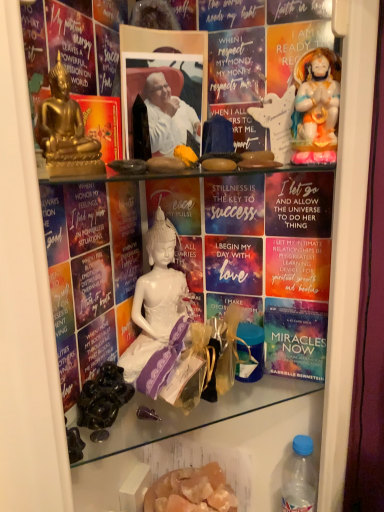
Identify the location of white porcelain statue at upper right. The height and width of the screenshot is (512, 384). (277, 122).

This screenshot has height=512, width=384. I want to click on gold polished buddha statue at upper left, which is the second person from back to front, so click(63, 122).

The width and height of the screenshot is (384, 512). Describe the element at coordinates (63, 122) in the screenshot. I see `gold polished buddha statue at upper left, which is the second person from back to front` at that location.

Image resolution: width=384 pixels, height=512 pixels. Describe the element at coordinates (316, 99) in the screenshot. I see `white glossy statue at upper right, which ranks as the first person in right-to-left order` at that location.

This screenshot has height=512, width=384. Identify the location of translucent orange crystals at lower center, which ranks as the first food in bottom-to-top order. (191, 490).

The height and width of the screenshot is (512, 384). What are the coordinates of `blue plastic bottle at lower right` in the screenshot? It's located at (300, 478).

From the picture: Measure the distance between point (314,479) and camera.

Point (314,479) and camera are 28.62 inches apart.

This screenshot has width=384, height=512. I want to click on white porcelain statue at upper right, so click(277, 122).

Which is correct: black glossy grapes at lower left, marked as the first food in a left-to-right arrangement, is inside gold polished buddha statue at upper left, which is the second person from back to front, or outside of it?

black glossy grapes at lower left, marked as the first food in a left-to-right arrangement, lies outside gold polished buddha statue at upper left, which is the second person from back to front.

Is black glossy grapes at lower left, the 1th food positioned from the top, to the left of gold polished buddha statue at upper left, the 1th person in the left-to-right sequence, from the viewer's perspective?

No, black glossy grapes at lower left, the 1th food positioned from the top, is not to the left of gold polished buddha statue at upper left, the 1th person in the left-to-right sequence.

Is black glossy grapes at lower left, the 1th food from the front, positioned before gold polished buddha statue at upper left, which is the first person from front to back?

That is False.

From a real-world perspective, who is located higher, black glossy grapes at lower left, acting as the second food starting from the right, or gold polished buddha statue at upper left, the 1th person in the left-to-right sequence?

From a 3D spatial view, gold polished buddha statue at upper left, the 1th person in the left-to-right sequence, is above.

Considering the relative positions of gold polished buddha statue at upper left, the 1th person in the left-to-right sequence, and translucent orange crystals at lower center, marked as the second food in a front-to-back arrangement, in the image provided, is gold polished buddha statue at upper left, the 1th person in the left-to-right sequence, to the right of translucent orange crystals at lower center, marked as the second food in a front-to-back arrangement, from the viewer's perspective?

No.

How many degrees apart are the facing directions of gold polished buddha statue at upper left, the 1th person in the left-to-right sequence, and translucent orange crystals at lower center, marked as the second food in a front-to-back arrangement?

The angle between the facing direction of gold polished buddha statue at upper left, the 1th person in the left-to-right sequence, and the facing direction of translucent orange crystals at lower center, marked as the second food in a front-to-back arrangement, is 19.7 degrees.

Do you think gold polished buddha statue at upper left, which is the first person from front to back, is within translucent orange crystals at lower center, which ranks as the first food in right-to-left order, or outside of it?

gold polished buddha statue at upper left, which is the first person from front to back, is located beyond the bounds of translucent orange crystals at lower center, which ranks as the first food in right-to-left order.

Considering the sizes of gold polished buddha statue at upper left, which is the first person from front to back, and translucent orange crystals at lower center, marked as the first food in a back-to-front arrangement, in the image, is gold polished buddha statue at upper left, which is the first person from front to back, wider or thinner than translucent orange crystals at lower center, marked as the first food in a back-to-front arrangement,?

Clearly, gold polished buddha statue at upper left, which is the first person from front to back, has less width compared to translucent orange crystals at lower center, marked as the first food in a back-to-front arrangement.

From a real-world perspective, who is located higher, blue plastic bottle at lower right or white porcelain statue at upper right?

white porcelain statue at upper right is physically above.

Identify the location of bottle below the white porcelain statue at upper right (from a real-world perspective). This screenshot has height=512, width=384. (300, 478).

Is blue plastic bottle at lower right positioned far away from white porcelain statue at upper right?

No, there isn't a large distance between blue plastic bottle at lower right and white porcelain statue at upper right.

In the scene shown: From the image's perspective, does blue plastic bottle at lower right appear lower than white porcelain statue at upper right?

Correct, blue plastic bottle at lower right appears lower than white porcelain statue at upper right in the image.

Where is `person located on the right of gold polished buddha statue at upper left, marked as the second person in a right-to-left arrangement`? person located on the right of gold polished buddha statue at upper left, marked as the second person in a right-to-left arrangement is located at coordinates (316, 99).

From the image's perspective, is white glossy statue at upper right, acting as the second person starting from the left, above or below gold polished buddha statue at upper left, which is the first person from front to back?

From the image's perspective, white glossy statue at upper right, acting as the second person starting from the left, appears above gold polished buddha statue at upper left, which is the first person from front to back.

Which of these two, white glossy statue at upper right, acting as the second person starting from the left, or gold polished buddha statue at upper left, the 1th person in the left-to-right sequence, is bigger?

white glossy statue at upper right, acting as the second person starting from the left.

Is white glossy statue at upper right, which ranks as the first person in right-to-left order, oriented away from gold polished buddha statue at upper left, marked as the second person in a right-to-left arrangement?

No, gold polished buddha statue at upper left, marked as the second person in a right-to-left arrangement, is not at the back of white glossy statue at upper right, which ranks as the first person in right-to-left order.

Which is less distant, (191,484) or (82,410)?

Point (191,484) is farther from the camera than point (82,410).

Are translucent orange crystals at lower center, marked as the second food in a front-to-back arrangement, and black glossy grapes at lower left, marked as the first food in a left-to-right arrangement, far apart?

Actually, translucent orange crystals at lower center, marked as the second food in a front-to-back arrangement, and black glossy grapes at lower left, marked as the first food in a left-to-right arrangement, are a little close together.

In the image, there is a black glossy grapes at lower left, acting as the 2th food starting from the bottom. Where is `food below it (from a real-world perspective)`? This screenshot has width=384, height=512. food below it (from a real-world perspective) is located at coordinates (191, 490).

Is translucent orange crystals at lower center, which ranks as the first food in bottom-to-top order, to the left of black glossy grapes at lower left, marked as the first food in a left-to-right arrangement, from the viewer's perspective?

No.

Does white glossy statue at upper right, the first person in the back-to-front sequence, turn towards blue plastic bottle at lower right?

No.

Can you confirm if white glossy statue at upper right, the first person in the back-to-front sequence, is shorter than blue plastic bottle at lower right?

Yes, white glossy statue at upper right, the first person in the back-to-front sequence, is shorter than blue plastic bottle at lower right.

Are white glossy statue at upper right, arranged as the second person when viewed from the front, and blue plastic bottle at lower right beside each other?

No, white glossy statue at upper right, arranged as the second person when viewed from the front, is not making contact with blue plastic bottle at lower right.

In the scene shown: Considering the positions of objects purple satin dress at center and white glossy statue at upper right, arranged as the second person when viewed from the front, in the image provided, who is in front, purple satin dress at center or white glossy statue at upper right, arranged as the second person when viewed from the front,?

Positioned in front is white glossy statue at upper right, arranged as the second person when viewed from the front.

Is purple satin dress at center positioned far away from white glossy statue at upper right, which ranks as the first person in right-to-left order?

That's not correct — purple satin dress at center is a little close to white glossy statue at upper right, which ranks as the first person in right-to-left order.

Is purple satin dress at center wider or thinner than white glossy statue at upper right, arranged as the second person when viewed from the front?

purple satin dress at center is thinner than white glossy statue at upper right, arranged as the second person when viewed from the front.

Is purple satin dress at center aimed at white glossy statue at upper right, the first person in the back-to-front sequence?

No, purple satin dress at center is not aimed at white glossy statue at upper right, the first person in the back-to-front sequence.

The image size is (384, 512). What are the coordinates of `food that is the 1st object located behind the gold polished buddha statue at upper left, which is the first person from front to back` in the screenshot? It's located at (103, 397).

The height and width of the screenshot is (512, 384). In order to click on person that is the 2nd object located in front of the translucent orange crystals at lower center, the 2th food from the top in this screenshot , I will do `click(63, 122)`.

When comparing their distances from purple satin dress at center, does white porcelain statue at upper right or gold polished buddha statue at upper left, which is the second person from back to front, seem further?

white porcelain statue at upper right.

Based on their spatial positions, is gold polished buddha statue at upper left, the 1th person in the left-to-right sequence, or translucent orange crystals at lower center, which is the second food from left to right, further from purple satin dress at center?

Based on the image, gold polished buddha statue at upper left, the 1th person in the left-to-right sequence, appears to be further to purple satin dress at center.

When comparing their distances from black glossy grapes at lower left, the 1th food positioned from the top, does blue plastic bottle at lower right or white porcelain statue at upper right seem further?

white porcelain statue at upper right is further to black glossy grapes at lower left, the 1th food positioned from the top.

From the image, which object appears to be farther from white porcelain statue at upper right, white glossy statue at upper right, the first person in the back-to-front sequence, or purple satin dress at center?

The object further to white porcelain statue at upper right is purple satin dress at center.

Looking at the image, which one is located closer to white glossy statue at upper right, acting as the second person starting from the left, white porcelain statue at upper right or translucent orange crystals at lower center, marked as the first food in a back-to-front arrangement?

white porcelain statue at upper right is positioned closer to the anchor white glossy statue at upper right, acting as the second person starting from the left.

Based on their spatial positions, is purple satin dress at center or white glossy statue at upper right, the first person in the back-to-front sequence, closer to gold polished buddha statue at upper left, which is the first person from front to back?

white glossy statue at upper right, the first person in the back-to-front sequence, is closer to gold polished buddha statue at upper left, which is the first person from front to back.

Estimate the real-world distances between objects in this image. Which object is closer to gold polished buddha statue at upper left, which is the second person from back to front, white porcelain statue at upper right or purple satin dress at center?

The object closer to gold polished buddha statue at upper left, which is the second person from back to front, is white porcelain statue at upper right.

Estimate the real-world distances between objects in this image. Which object is further from purple satin dress at center, white glossy statue at upper right, arranged as the second person when viewed from the front, or white porcelain statue at upper right?

Among the two, white glossy statue at upper right, arranged as the second person when viewed from the front, is located further to purple satin dress at center.

The height and width of the screenshot is (512, 384). I want to click on fancy dress between white glossy statue at upper right, acting as the second person starting from the left, and translucent orange crystals at lower center, which ranks as the first food in right-to-left order, vertically, so click(x=150, y=337).

Where is `person between white porcelain statue at upper right and translucent orange crystals at lower center, which ranks as the first food in bottom-to-top order, in the vertical direction`? The width and height of the screenshot is (384, 512). person between white porcelain statue at upper right and translucent orange crystals at lower center, which ranks as the first food in bottom-to-top order, in the vertical direction is located at coordinates (63, 122).

At what (x,y) coordinates should I click in order to perform the action: click on bottle between white glossy statue at upper right, which ranks as the first person in right-to-left order, and translucent orange crystals at lower center, marked as the first food in a back-to-front arrangement, in the vertical direction. Please return your answer as a coordinate pair (x, y). This screenshot has height=512, width=384. Looking at the image, I should click on (300, 478).

Locate an element on the screen. The image size is (384, 512). person between white porcelain statue at upper right and purple satin dress at center in the vertical direction is located at coordinates (63, 122).